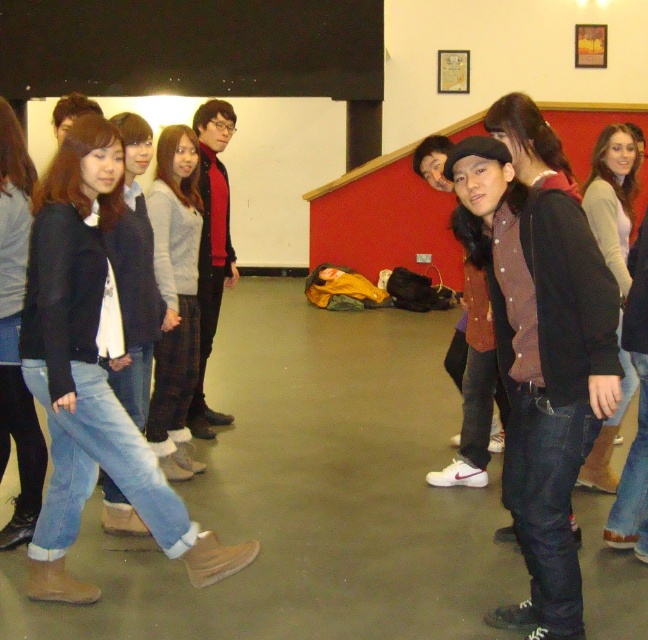
You are organizing a space and need to place the denim jacket at center and the denim jeans at left into storage. Given their sizes, which item requires a narrower storage space?

The denim jacket at center has a lesser width compared to the denim jeans at left, so it requires a narrower storage space.

You are standing in the room and want to pick up an item. There are two points marked in the scene, point A at coordinates point (507, 481) and point B at coordinates point (148, 218). Which point is closer to you?

Point A at coordinates point (507, 481) is closer to you than point B at coordinates point (148, 218).